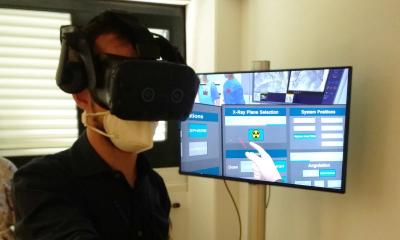
Image resolution: width=400 pixels, height=240 pixels. What are the coordinates of `window` in the screenshot? It's located at (37, 111).